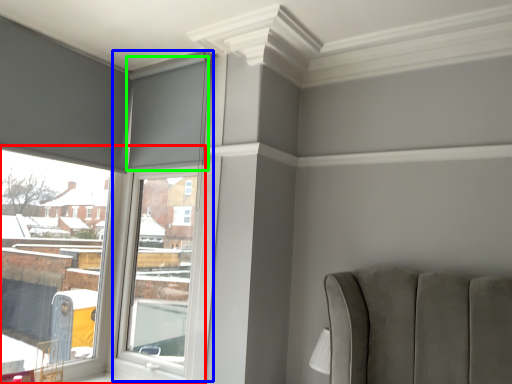
Question: Which is nearer to the window (highlighted by a red box)? window frame (highlighted by a blue box) or curtain (highlighted by a green box).

Choices:
 (A) window frame
 (B) curtain

Answer: (A)